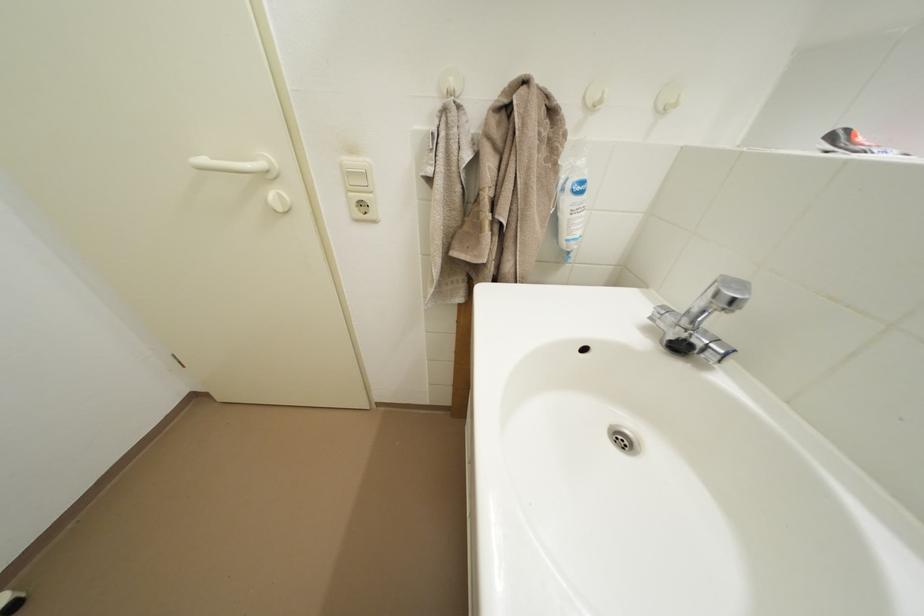
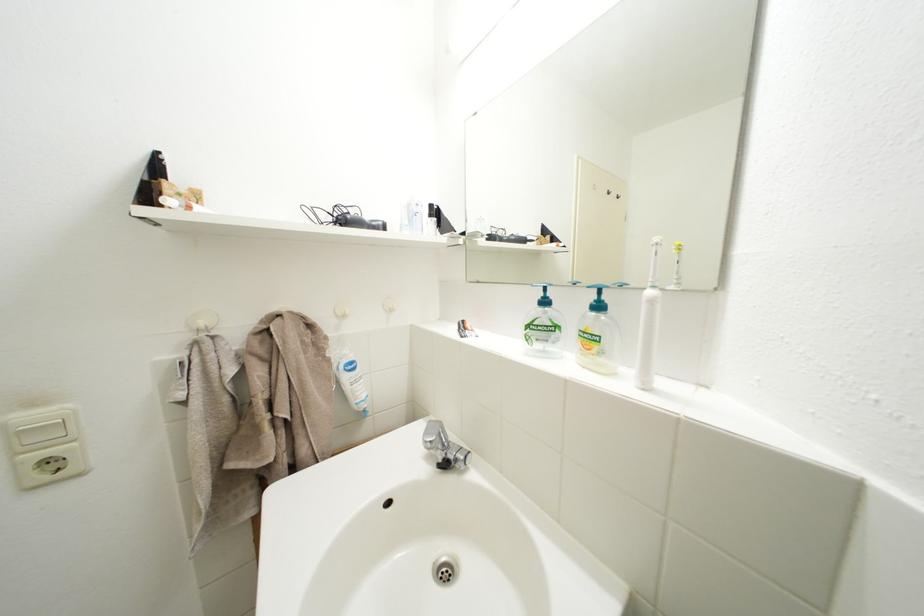
In the second image, find the point that corresponds to [748,296] in the first image.

(441, 440)